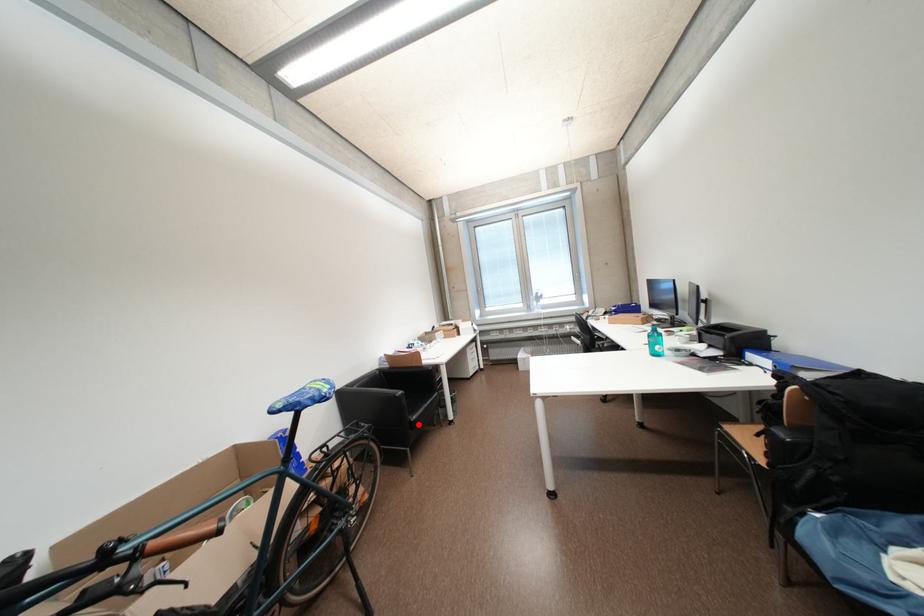
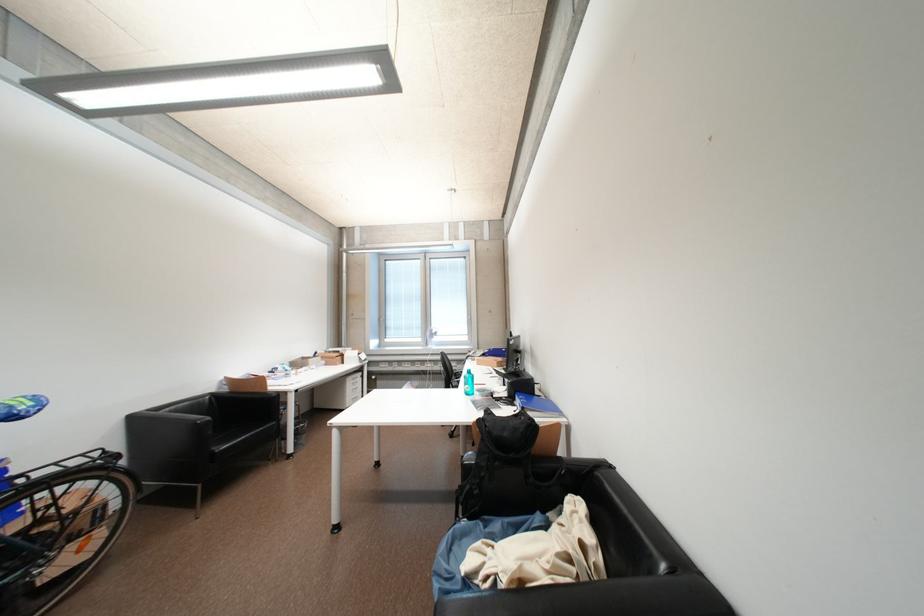
Where in the second image is the point corresponding to the highlighted location from the first image?

(221, 456)